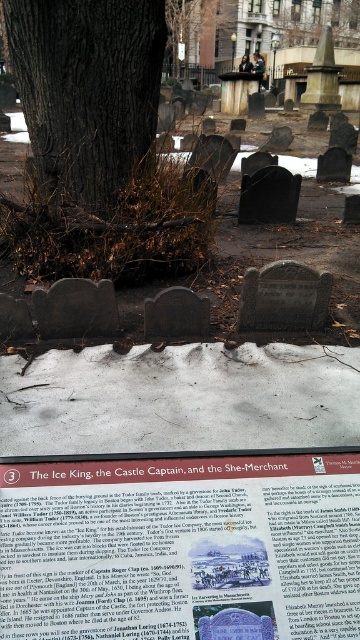
Which of these two, matte brown sign at center or brown rough bark tree at center, stands shorter?

matte brown sign at center

Can you confirm if matte brown sign at center is positioned below brown rough bark tree at center?

Yes, matte brown sign at center is below brown rough bark tree at center.

Does point (155, 493) come in front of point (90, 13)?

Yes, it is in front of point (90, 13).

Identify the location of matte brown sign at center. coord(181,547).